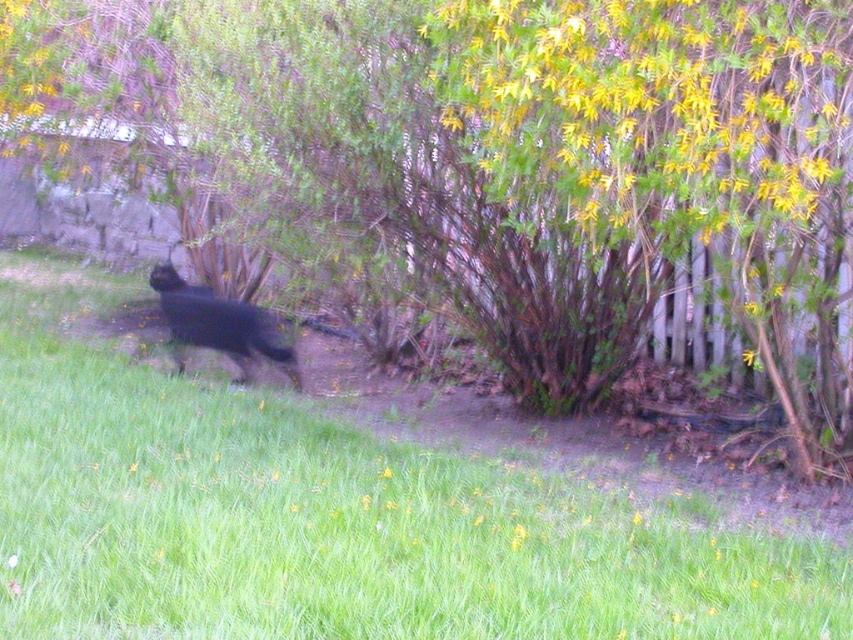
From the picture: You are standing in the backyard and see the green grass at lower left and the black furry dog at center. Which object is positioned to the right of the other?

The green grass at lower left is to the right of the black furry dog at center.